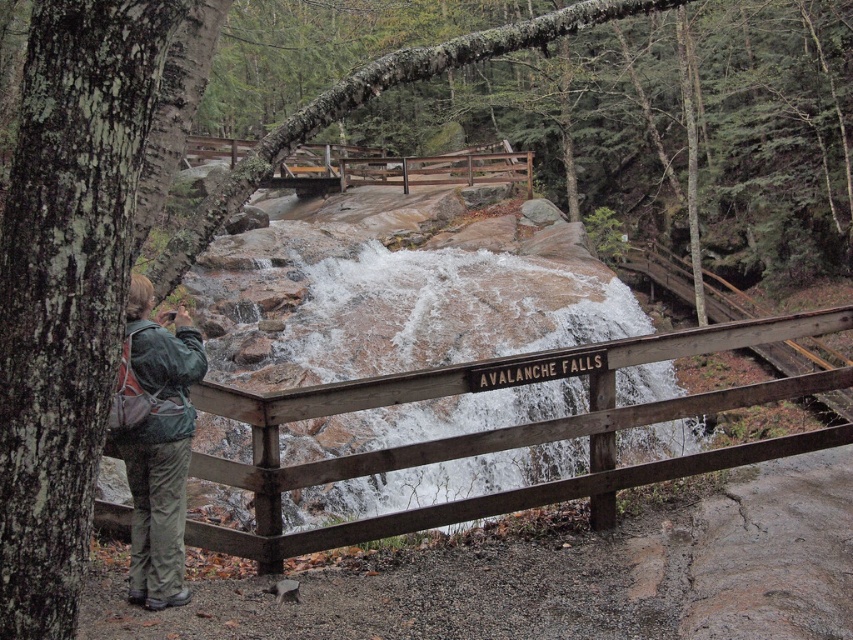
Which is more to the right, wooden fence at center or green fabric jacket at lower left?

wooden fence at center

The image size is (853, 640). Identify the location of wooden fence at center. (498, 433).

Can you confirm if wooden fence at center is positioned below wooden bridge at center?

Yes, wooden fence at center is below wooden bridge at center.

What do you see at coordinates (498, 433) in the screenshot?
I see `wooden fence at center` at bounding box center [498, 433].

Identify the location of wooden fence at center. (498, 433).

Between point (194, 346) and point (384, 157), which one is positioned in front?

Point (194, 346) is in front.

Does green fabric jacket at lower left appear on the left side of wooden bridge at center?

Incorrect, green fabric jacket at lower left is not on the left side of wooden bridge at center.

Who is more forward, (141,381) or (426,170)?

Positioned in front is point (141,381).

Locate an element on the screen. green fabric jacket at lower left is located at coordinates (158, 445).